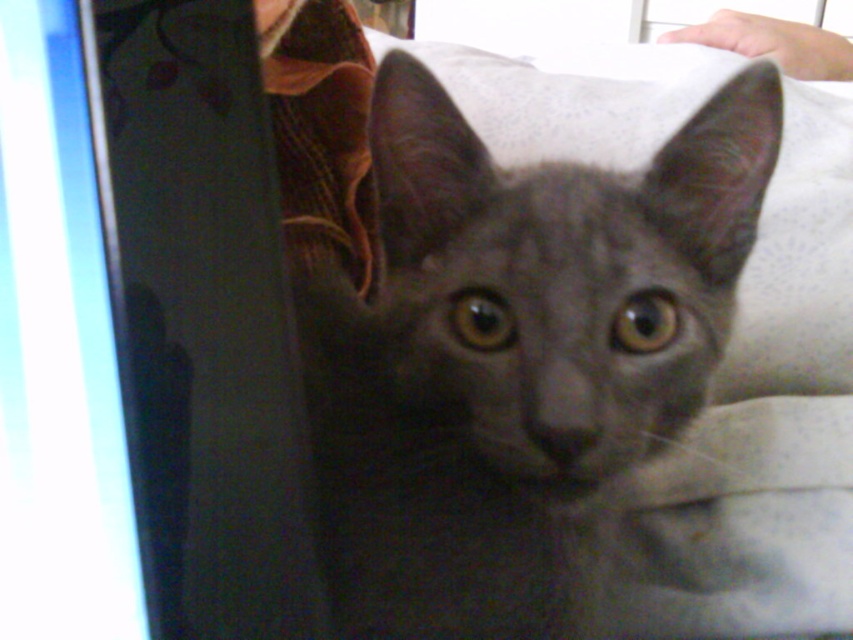
Question: Is gray matte fur cat at center below matte plastic computer screen at left?

Choices:
 (A) yes
 (B) no

Answer: (B)

Question: Does gray matte fur cat at center have a larger size compared to matte plastic computer screen at left?

Choices:
 (A) no
 (B) yes

Answer: (B)

Question: Which of the following is the farthest from the observer?

Choices:
 (A) matte plastic computer screen at left
 (B) gray matte fur cat at center

Answer: (B)

Question: Which of the following is the closest to the observer?

Choices:
 (A) matte plastic computer screen at left
 (B) gray matte fur cat at center

Answer: (A)

Question: Is gray matte fur cat at center to the left of matte plastic computer screen at left from the viewer's perspective?

Choices:
 (A) no
 (B) yes

Answer: (A)

Question: Which point is closer to the camera?

Choices:
 (A) (437, 209)
 (B) (10, 106)

Answer: (B)